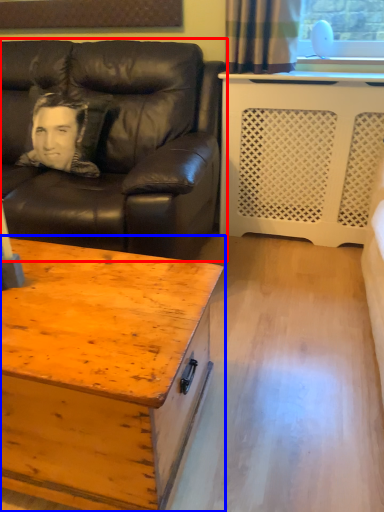
Question: Which object appears closest to the camera in this image, studio couch (highlighted by a red box) or coffee table (highlighted by a blue box)?

Choices:
 (A) studio couch
 (B) coffee table

Answer: (B)